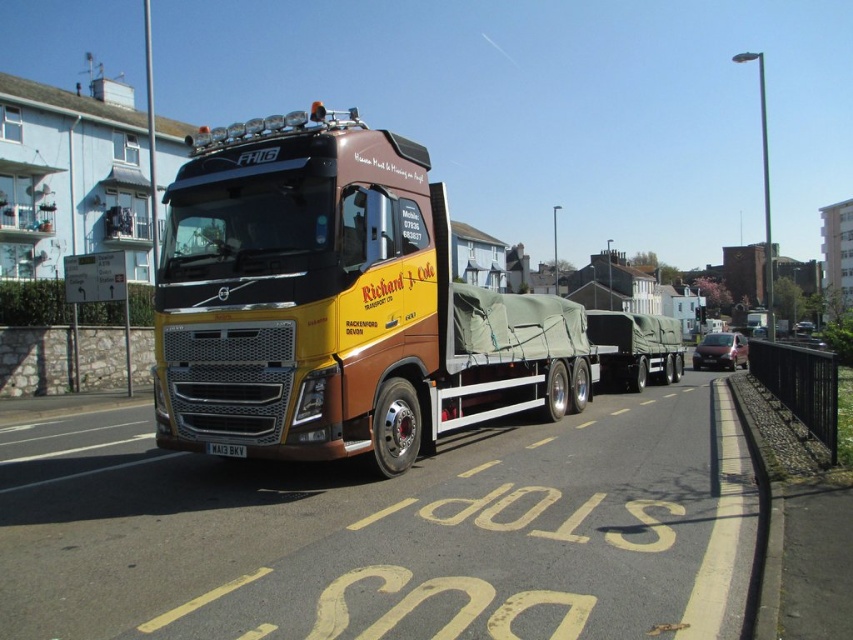
Who is shorter, yellow metallic truck at center or white plastic license plate at center?

white plastic license plate at center is shorter.

Is yellow metallic truck at center thinner than white plastic license plate at center?

Incorrect, yellow metallic truck at center's width is not less than white plastic license plate at center's.

Where is `yellow metallic truck at center`? yellow metallic truck at center is located at coordinates (335, 304).

Does yellow metallic truck at center have a smaller size compared to camouflage fabric trailer truck at center?

Incorrect, yellow metallic truck at center is not smaller in size than camouflage fabric trailer truck at center.

Does point (526, 298) come farther from viewer compared to point (647, 330)?

No, it is in front of (647, 330).

Who is more distant from viewer, (351,284) or (619,321)?

Point (619,321)

Where is `yellow metallic truck at center`? The width and height of the screenshot is (853, 640). yellow metallic truck at center is located at coordinates (335, 304).

Does point (631, 371) lie in front of point (227, 452)?

No, it is behind (227, 452).

Between point (657, 372) and point (219, 445), which one is positioned behind?

The point (657, 372) is more distant.

Based on the photo, who is more forward, (646, 332) or (244, 445)?

Positioned in front is point (244, 445).

Where is `camouflage fabric trailer truck at center`? The image size is (853, 640). camouflage fabric trailer truck at center is located at coordinates (635, 348).